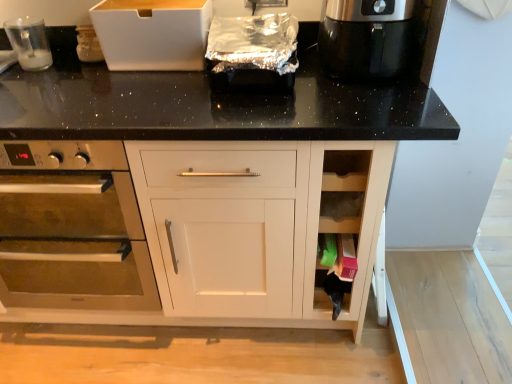
Question: Does white cardboard box at upper center have a lesser height compared to stainless steel oven at left?

Choices:
 (A) no
 (B) yes

Answer: (B)

Question: Is the depth of white cardboard box at upper center less than that of stainless steel oven at left?

Choices:
 (A) no
 (B) yes

Answer: (A)

Question: From a real-world perspective, is white cardboard box at upper center over stainless steel oven at left?

Choices:
 (A) yes
 (B) no

Answer: (A)

Question: Is white cardboard box at upper center wider than stainless steel oven at left?

Choices:
 (A) yes
 (B) no

Answer: (B)

Question: Does white cardboard box at upper center have a greater height compared to stainless steel oven at left?

Choices:
 (A) yes
 (B) no

Answer: (B)

Question: Does white cardboard box at upper center have a smaller size compared to stainless steel oven at left?

Choices:
 (A) no
 (B) yes

Answer: (B)

Question: Is white cardboard box at upper center completely or partially outside of clear plastic cup at upper left?

Choices:
 (A) yes
 (B) no

Answer: (A)

Question: From the image's perspective, is white cardboard box at upper center below clear plastic cup at upper left?

Choices:
 (A) yes
 (B) no

Answer: (B)

Question: Does white cardboard box at upper center have a larger size compared to clear plastic cup at upper left?

Choices:
 (A) no
 (B) yes

Answer: (B)

Question: Is white cardboard box at upper center thinner than clear plastic cup at upper left?

Choices:
 (A) no
 (B) yes

Answer: (A)

Question: Does white cardboard box at upper center have a smaller size compared to clear plastic cup at upper left?

Choices:
 (A) no
 (B) yes

Answer: (A)

Question: Does white cardboard box at upper center have a greater width compared to clear plastic cup at upper left?

Choices:
 (A) no
 (B) yes

Answer: (B)

Question: Considering the relative sizes of stainless steel oven at left and shiny black coffee maker at upper right in the image provided, is stainless steel oven at left shorter than shiny black coffee maker at upper right?

Choices:
 (A) no
 (B) yes

Answer: (A)